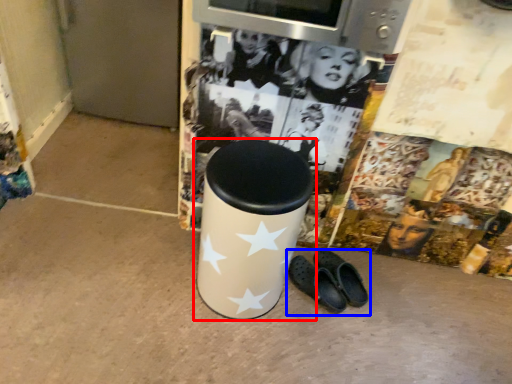
Question: Among these objects, which one is nearest to the camera, waste container (highlighted by a red box) or footwear (highlighted by a blue box)?

Choices:
 (A) waste container
 (B) footwear

Answer: (A)